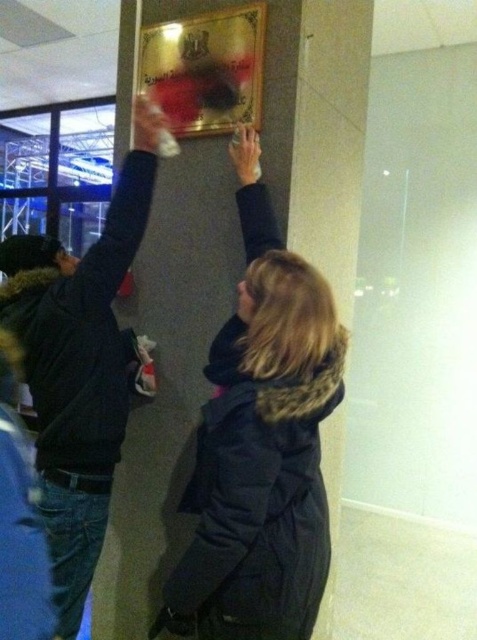
Who is higher up, black fur-lined coat at upper center or black fuzzy jacket at upper left?

black fuzzy jacket at upper left is higher up.

Does black fur-lined coat at upper center have a lesser width compared to black fuzzy jacket at upper left?

Yes, black fur-lined coat at upper center is thinner than black fuzzy jacket at upper left.

Measure the distance between black fur-lined coat at upper center and camera.

black fur-lined coat at upper center and camera are 4.30 feet apart.

Locate an element on the screen. black fur-lined coat at upper center is located at coordinates (262, 442).